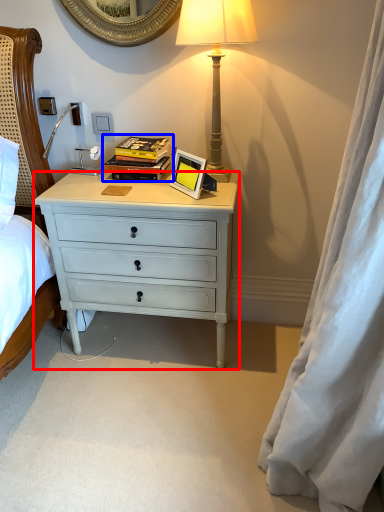
Question: Which of the following is the farthest to the observer, desk (highlighted by a red box) or book (highlighted by a blue box)?

Choices:
 (A) desk
 (B) book

Answer: (B)